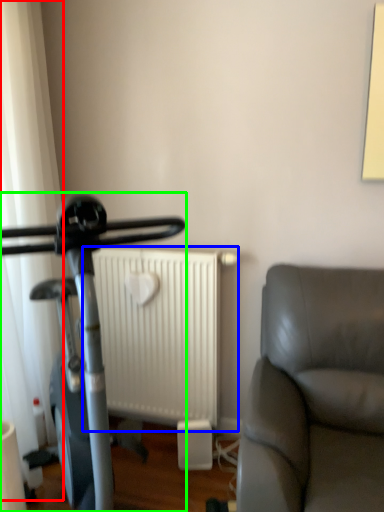
Question: Which is farther away from curtain (highlighted by a red box)? radiator (highlighted by a blue box) or stationary bicycle (highlighted by a green box)?

Choices:
 (A) radiator
 (B) stationary bicycle

Answer: (A)